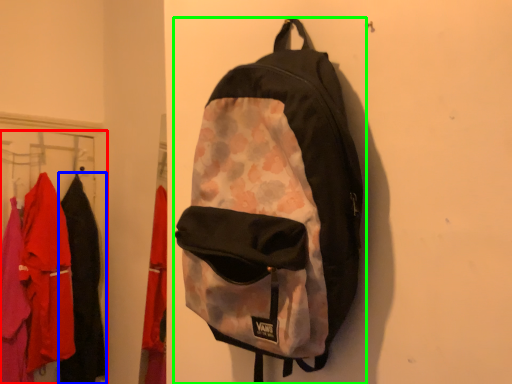
Question: Which object is positioned farthest from closet (highlighted by a red box)? Select from clothing (highlighted by a blue box) and backpack (highlighted by a green box).

Choices:
 (A) clothing
 (B) backpack

Answer: (B)